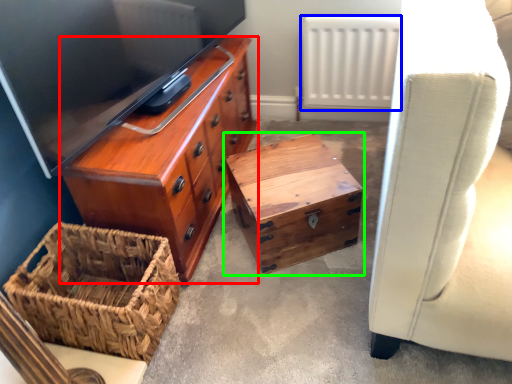
Question: Which is nearer to the chest of drawers (highlighted by a red box)? radiator (highlighted by a blue box) or table (highlighted by a green box).

Choices:
 (A) radiator
 (B) table

Answer: (B)